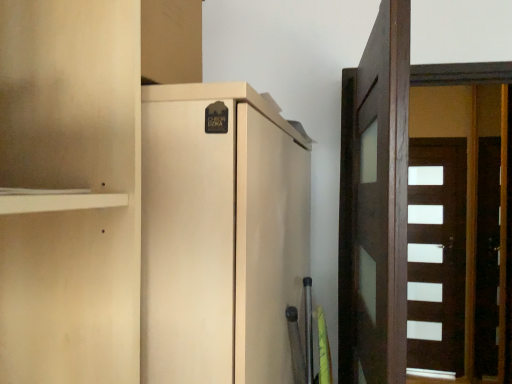
Question: In the image, is white glossy door at right, acting as the first door starting from the back, positioned in front of or behind dark brown wood door at right, the first door from the left?

Choices:
 (A) front
 (B) behind

Answer: (B)

Question: From the image's perspective, is white glossy door at right, acting as the first door starting from the back, located above or below dark brown wood door at right, acting as the 2th door starting from the back?

Choices:
 (A) below
 (B) above

Answer: (A)

Question: Which is nearer to the white glossy door at right, which ranks as the second door in left-to-right order?

Choices:
 (A) dark brown wood door at right, which is the second door from right to left
 (B) matte beige cupboard at center

Answer: (A)

Question: Which is farther from the dark brown wood door at right, placed as the first door when sorted from front to back?

Choices:
 (A) matte beige cupboard at center
 (B) white glossy door at right, acting as the first door starting from the back

Answer: (B)